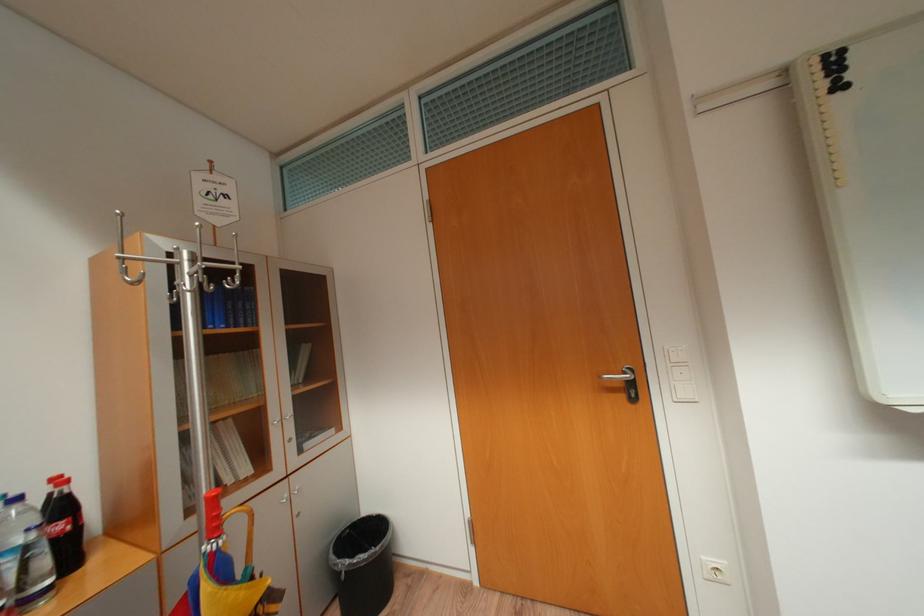
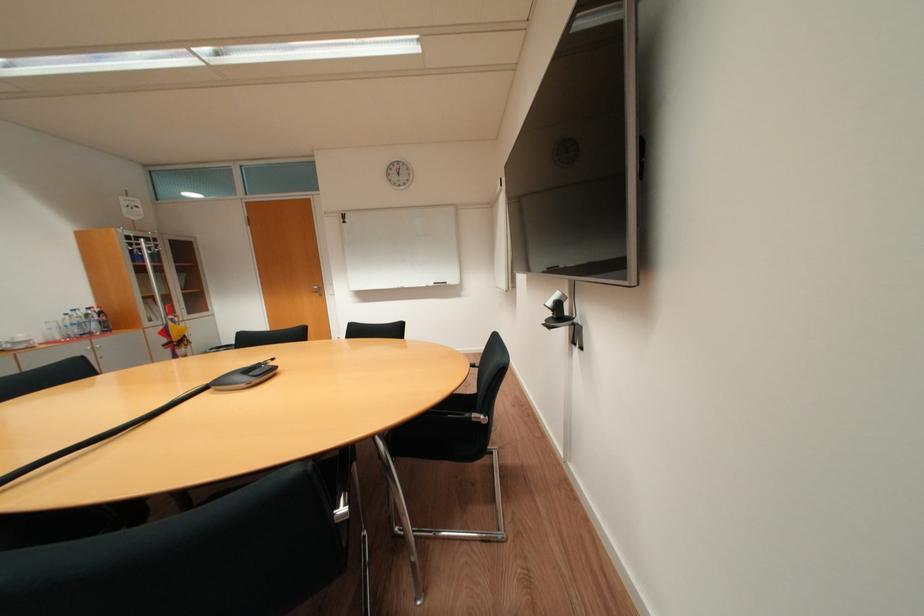
What movement of the cameraman would produce the second image?

The cameraman moved toward right, backward.